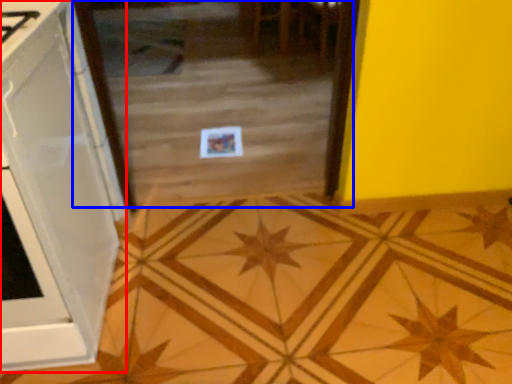
Question: Which point is further to the camera, cabinetry (highlighted by a red box) or glass door (highlighted by a blue box)?

Choices:
 (A) cabinetry
 (B) glass door

Answer: (B)